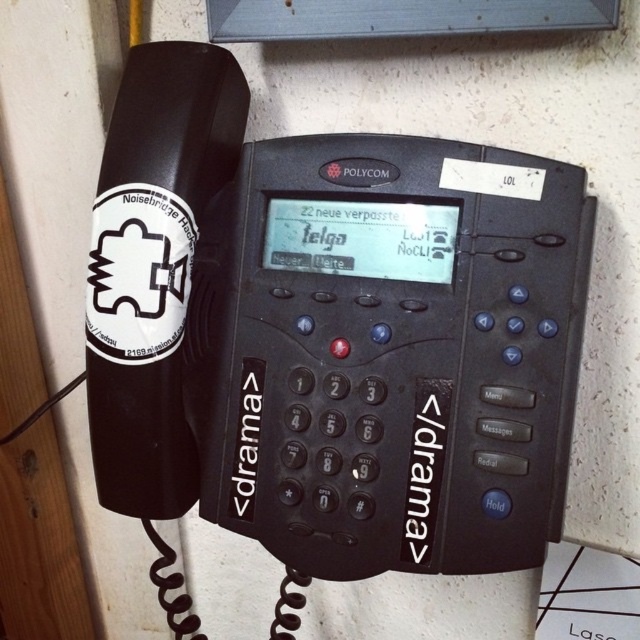
You are standing in front of a wall with a Polycom telephone. The phone has a black handset with a sticker that says Noisebridge Hacker and a coiled cord. The screen shows 22 missed calls and some text. Where exactly is the black plastic phone at center located in terms of coordinates?

The black plastic phone at center is located at coordinates point (330, 332).

From the picture: You are an office worker who just noticed the black plastic phone at center and the white sticker at left. Which object is wider?

The black plastic phone at center is wider than the white sticker at left.